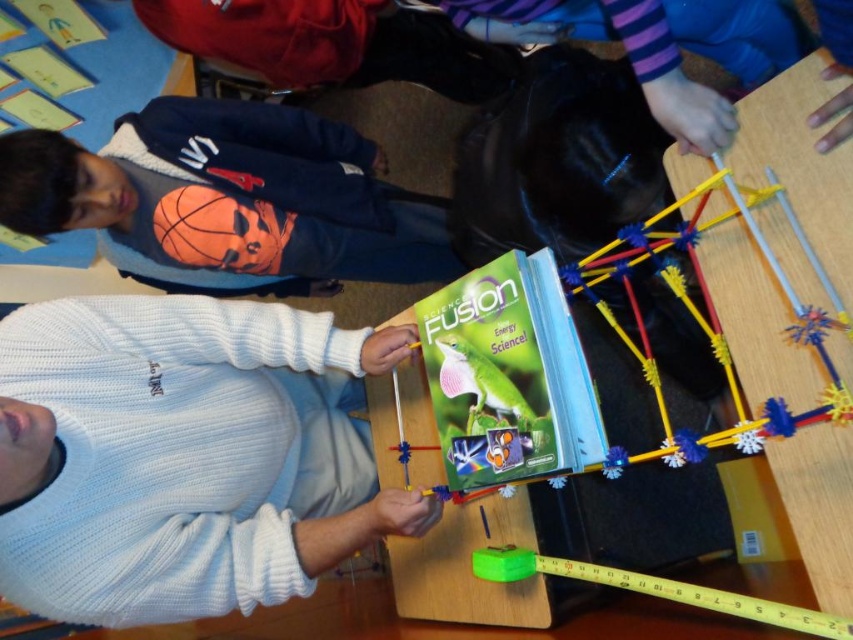
Which of these two, matte blue sweatshirt at left or orange matte basketball at center, stands shorter?

orange matte basketball at center is shorter.

Which is more to the right, matte blue sweatshirt at left or orange matte basketball at center?

matte blue sweatshirt at left is more to the right.

In order to click on matte blue sweatshirt at left in this screenshot , I will do `click(229, 193)`.

Does white knitted sweater at center appear over orange matte basketball at center?

No.

Does point (57, 474) come in front of point (236, 253)?

Yes, it is.

What are the coordinates of `white knitted sweater at center` in the screenshot? It's located at (167, 456).

Is white knitted sweater at center bigger than matte blue sweatshirt at left?

No.

Based on the photo, is white knitted sweater at center in front of matte blue sweatshirt at left?

Yes.

Is point (300, 397) positioned in front of point (341, 131)?

Yes, point (300, 397) is in front of point (341, 131).

Locate an element on the screen. Image resolution: width=853 pixels, height=640 pixels. white knitted sweater at center is located at coordinates (167, 456).